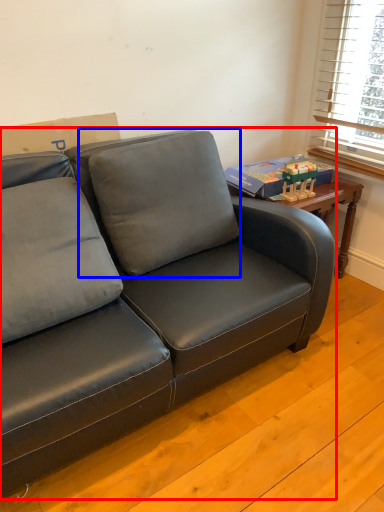
Question: Which object appears farthest to the camera in this image, studio couch (highlighted by a red box) or pillow (highlighted by a blue box)?

Choices:
 (A) studio couch
 (B) pillow

Answer: (B)